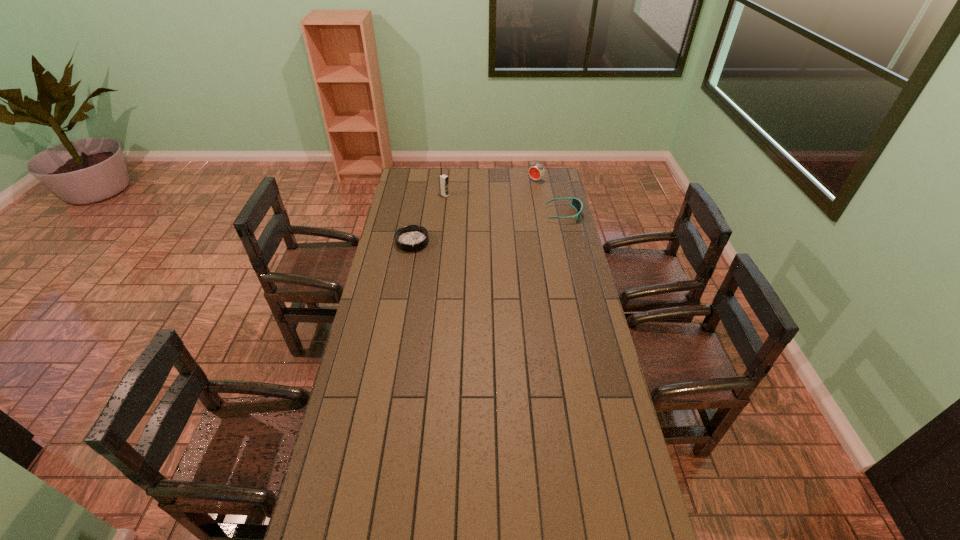
In order to click on the shortest object in this screenshot , I will do [411, 238].

What are the coordinates of `the leftmost object` in the screenshot? It's located at (411, 238).

The image size is (960, 540). What are the coordinates of `sunglasses` in the screenshot? It's located at (576, 203).

In order to click on the second nearest object in this screenshot , I will do `click(576, 203)`.

Find the location of a particular element. This screenshot has height=540, width=960. the third shortest object is located at coordinates (537, 171).

Image resolution: width=960 pixels, height=540 pixels. In order to click on the farthest object in this screenshot , I will do `click(537, 171)`.

Locate an element on the screen. This screenshot has height=540, width=960. the third nearest object is located at coordinates (443, 179).

Where is `the third object from right to left`? This screenshot has width=960, height=540. the third object from right to left is located at coordinates tap(443, 179).

The width and height of the screenshot is (960, 540). In order to click on free space located on the front of the leftmost object in this screenshot , I will do [x=405, y=282].

Locate an element on the screen. This screenshot has width=960, height=540. free region located on the face of the farthest object is located at coordinates (511, 200).